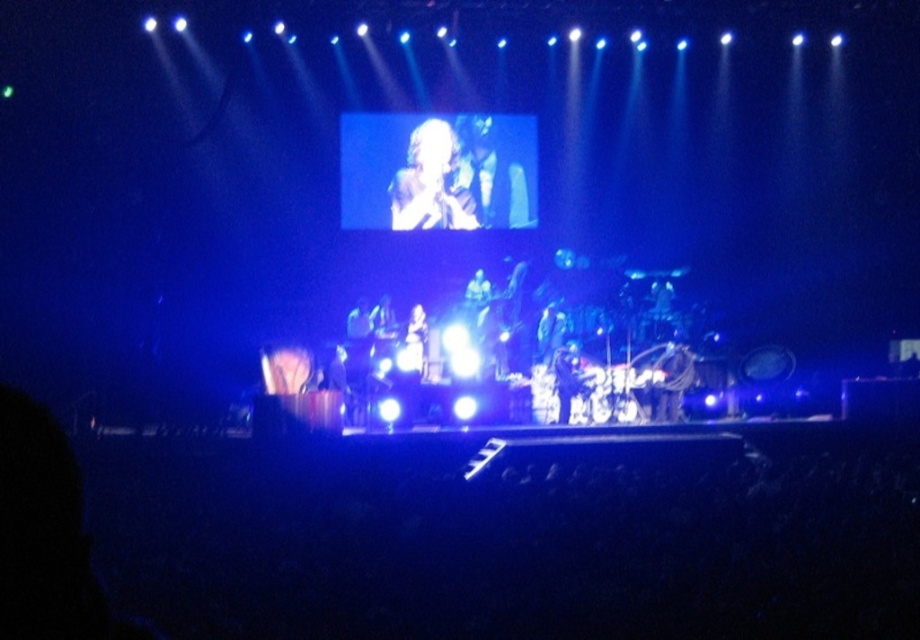
Question: Is blonde hair at center positioned in front of matte black microphone at center?

Choices:
 (A) yes
 (B) no

Answer: (B)

Question: Observing the image, what is the correct spatial positioning of shiny black guitar at center in reference to blonde hair at center?

Choices:
 (A) right
 (B) left

Answer: (A)

Question: Which object appears farthest from the camera in this image?

Choices:
 (A) shiny black guitar at center
 (B) matte black microphone at center
 (C) blonde hair at center

Answer: (A)

Question: Among these objects, which one is farthest from the camera?

Choices:
 (A) matte black microphone at center
 (B) shiny black guitar at center

Answer: (B)

Question: Which object is the closest to the matte black microphone at center?

Choices:
 (A) shiny black guitar at center
 (B) blonde hair at center

Answer: (B)

Question: Is blonde hair at center behind matte black microphone at center?

Choices:
 (A) no
 (B) yes

Answer: (B)